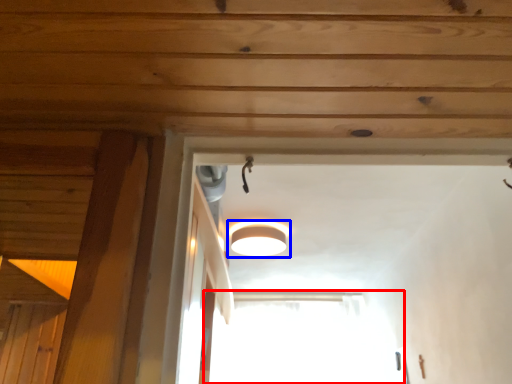
Question: Which object appears farthest to the camera in this image, window (highlighted by a red box) or lamp (highlighted by a blue box)?

Choices:
 (A) window
 (B) lamp

Answer: (A)